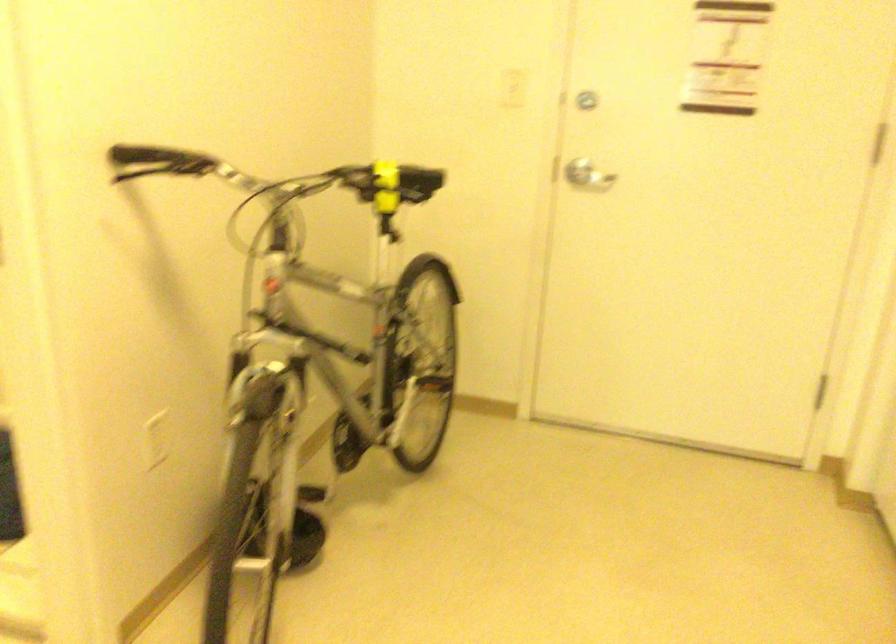
This screenshot has height=644, width=896. What do you see at coordinates (588, 175) in the screenshot? I see `the silver door handle` at bounding box center [588, 175].